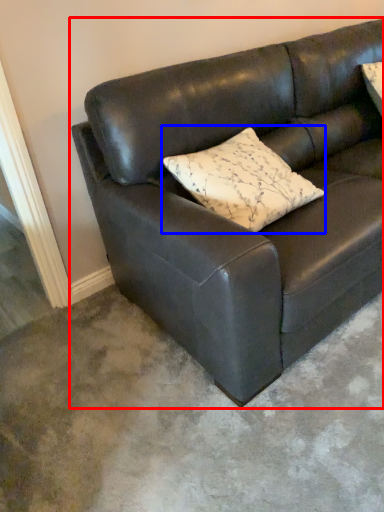
Question: Which of the following is the closest to the observer, studio couch (highlighted by a red box) or pillow (highlighted by a blue box)?

Choices:
 (A) studio couch
 (B) pillow

Answer: (A)